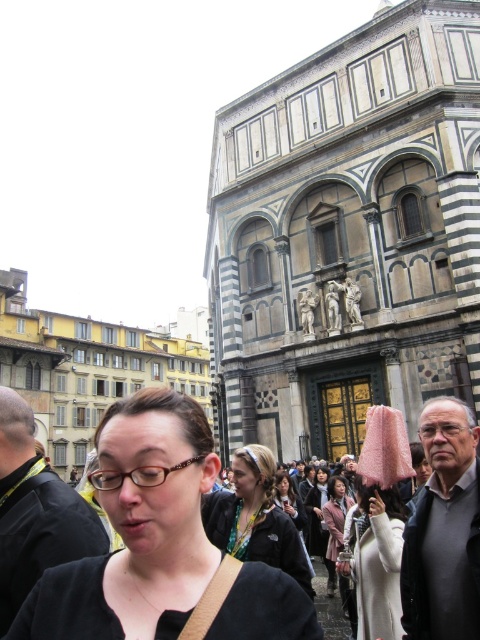
Question: Among these objects, which one is nearest to the camera?

Choices:
 (A) matte black hair at center
 (B) matte black jacket at center
 (C) light brown fabric coat at center

Answer: (B)

Question: Which object appears closest to the camera in this image?

Choices:
 (A) matte black hair at center
 (B) white fuzzy hat at center
 (C) black fabric jacket at lower left

Answer: (C)

Question: Where is white fuzzy hat at center located in relation to light brown fabric coat at center in the image?

Choices:
 (A) right
 (B) left

Answer: (A)

Question: Which object is the farthest from the matte black glasses at center?

Choices:
 (A) matte black hair at center
 (B) light brown fabric coat at center

Answer: (B)

Question: Is matte black glasses at center wider than black fabric jacket at lower left?

Choices:
 (A) yes
 (B) no

Answer: (A)

Question: Considering the relative positions of matte black glasses at center and light brown fabric coat at center in the image provided, where is matte black glasses at center located with respect to light brown fabric coat at center?

Choices:
 (A) above
 (B) below

Answer: (A)